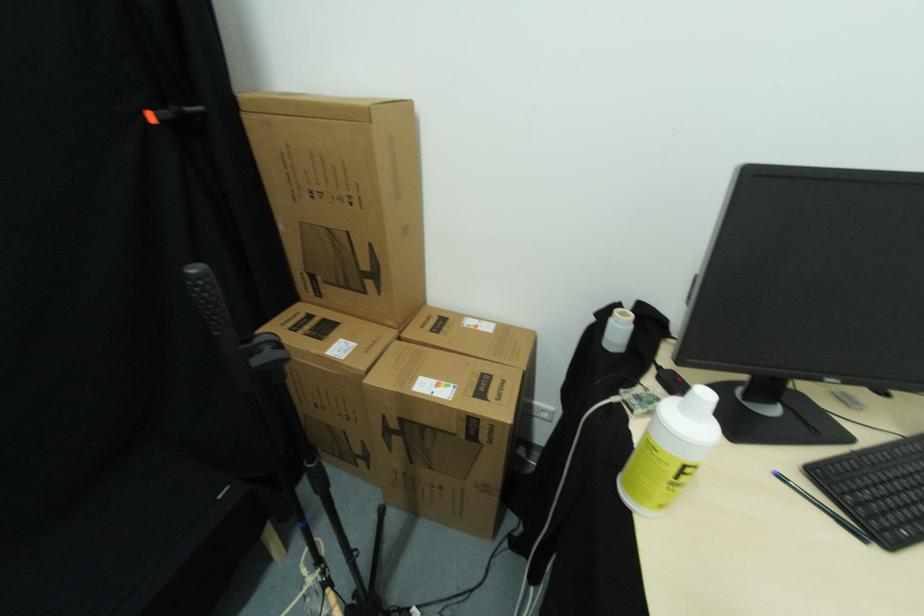
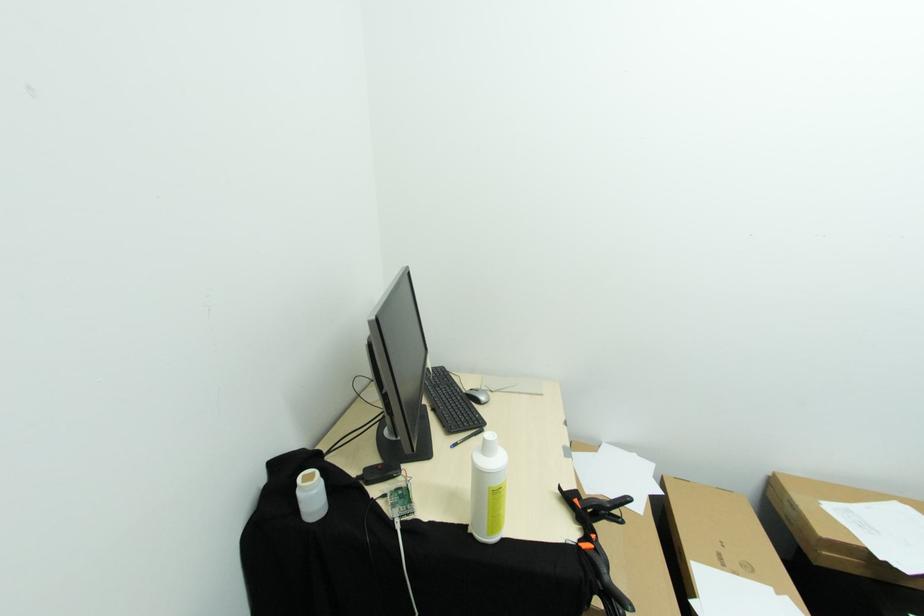
Locate, in the second image, the point that corresponds to point 881,548 in the first image.

(487, 431)